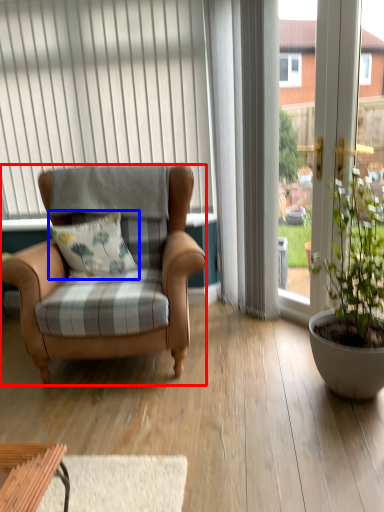
Question: Which object appears closest to the camera in this image, chair (highlighted by a red box) or pillow (highlighted by a blue box)?

Choices:
 (A) chair
 (B) pillow

Answer: (A)